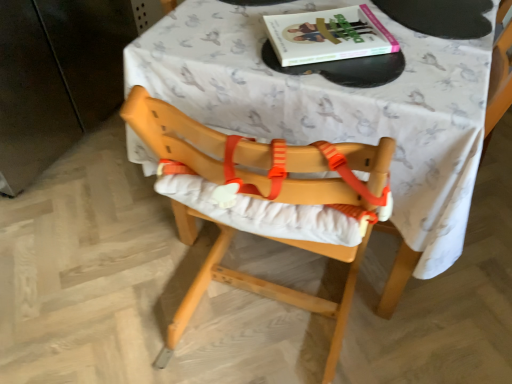
Image resolution: width=512 pixels, height=384 pixels. I want to click on free location to the left of natural wood highchair at center, so click(133, 291).